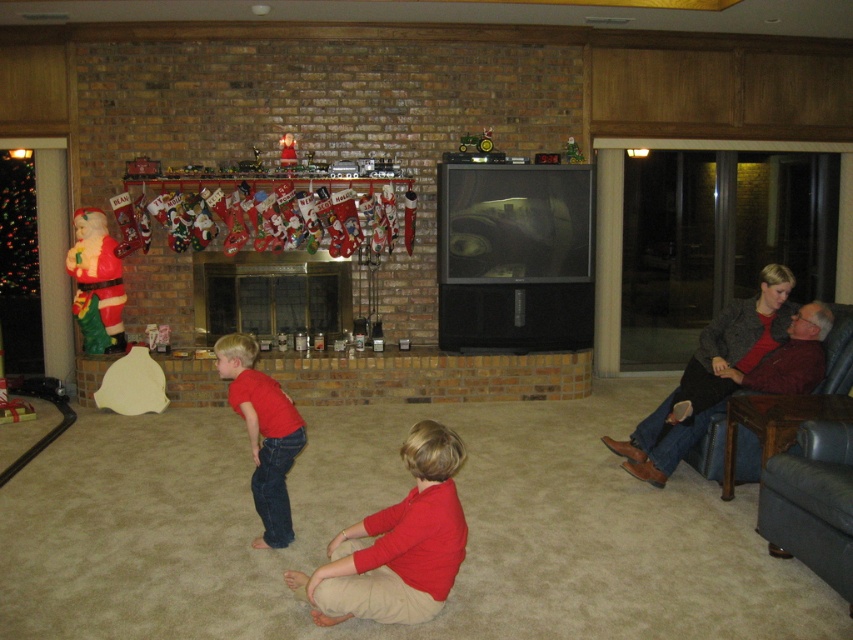
From the picture: Can you confirm if dark gray sweater at right is smaller than red matte shirt at center?

Incorrect, dark gray sweater at right is not smaller in size than red matte shirt at center.

Is point (772, 304) closer to viewer compared to point (254, 449)?

No, it is behind (254, 449).

Identify the location of dark gray sweater at right. (709, 376).

Does matte red shirt at center appear on the right side of brick fireplace at center?

Correct, you'll find matte red shirt at center to the right of brick fireplace at center.

This screenshot has width=853, height=640. Find the location of `matte red shirt at center`. matte red shirt at center is located at coordinates (398, 541).

Is brick fireplace at center thinner than red matte shirt at center?

No.

Is point (283, 259) positioned in front of point (233, 394)?

No, it is not.

Where is `brick fireplace at center`? This screenshot has width=853, height=640. brick fireplace at center is located at coordinates (270, 292).